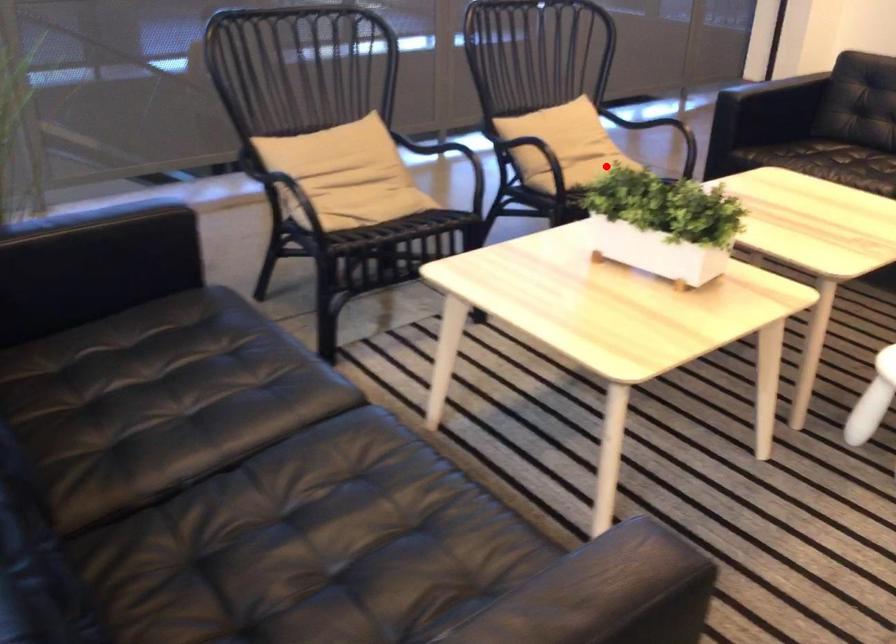
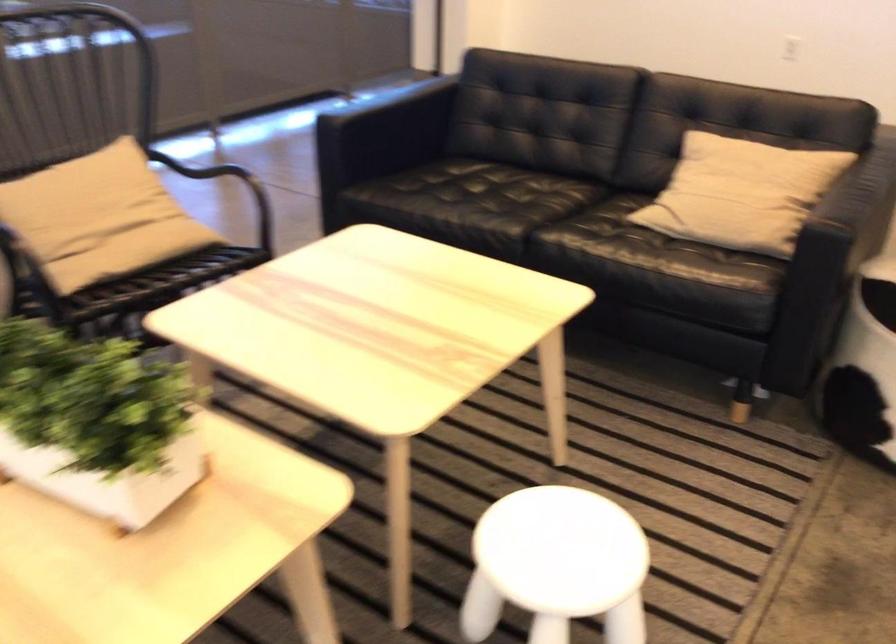
Question: I am providing you with two images of the same scene from different viewpoints. A red point is shown in image1. For the corresponding object point in image2, is it positioned nearer or farther from the camera?

Choices:
 (A) Nearer
 (B) Farther

Answer: (A)